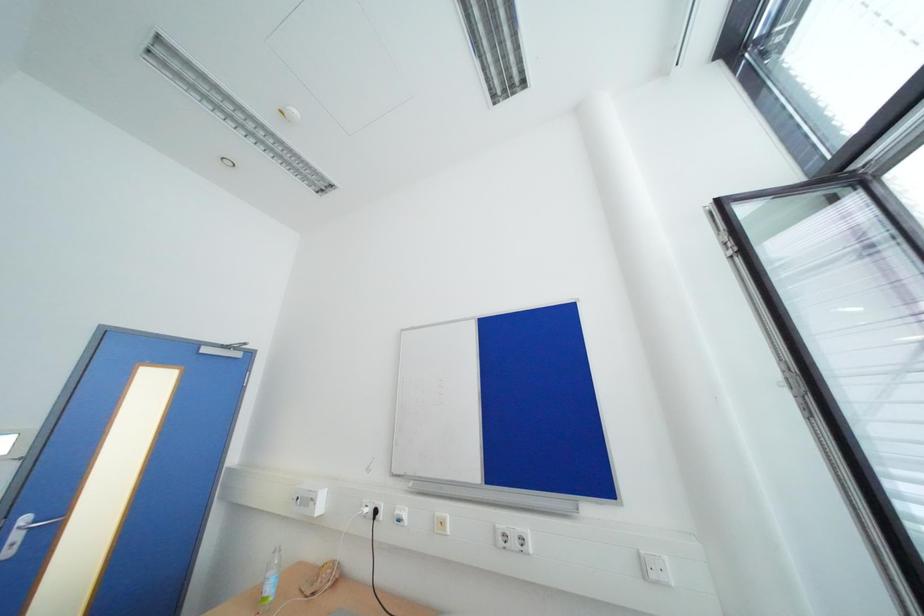
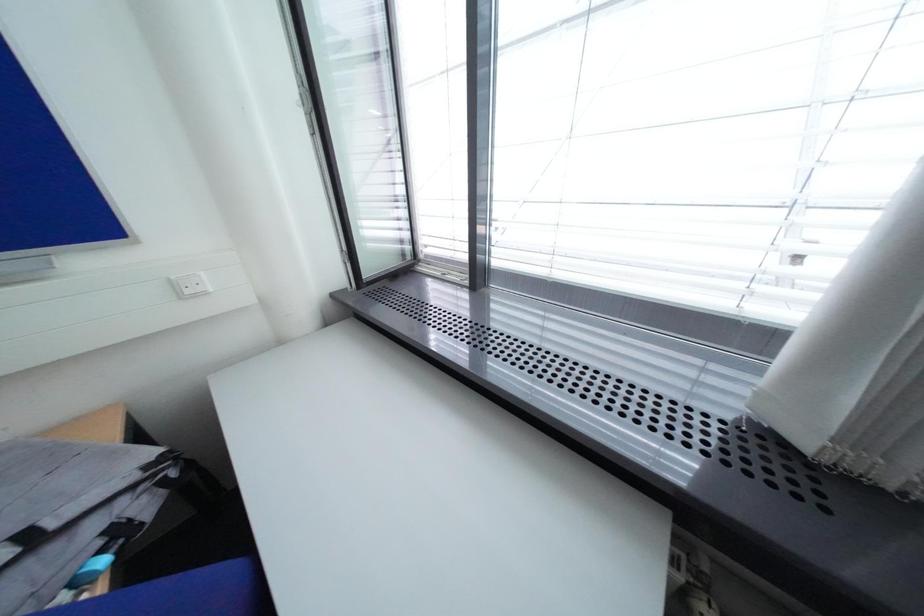
First-person continuous shooting, in which direction is the camera rotating?

The rotation direction of the camera is right-down.